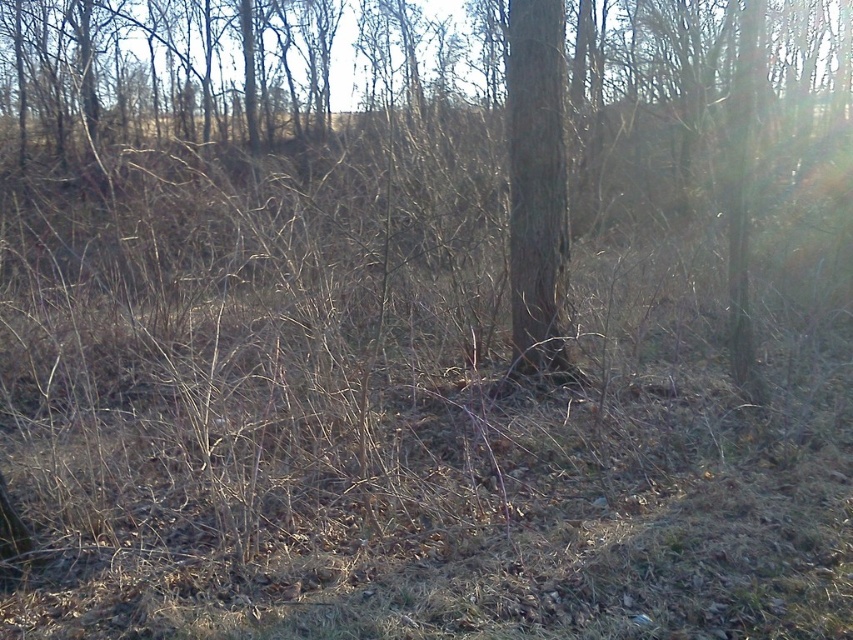
Question: Among these objects, which one is farthest from the camera?

Choices:
 (A) brown rough tree at center
 (B) brown rough bark tree at center

Answer: (B)

Question: Does brown rough tree at center appear under brown rough bark tree at center?

Choices:
 (A) no
 (B) yes

Answer: (A)

Question: Is brown rough tree at center above brown rough bark tree at center?

Choices:
 (A) yes
 (B) no

Answer: (A)

Question: Does brown rough tree at center appear over brown rough bark tree at center?

Choices:
 (A) yes
 (B) no

Answer: (A)

Question: Which point appears farthest from the camera in this image?

Choices:
 (A) (312, 96)
 (B) (514, 67)

Answer: (A)